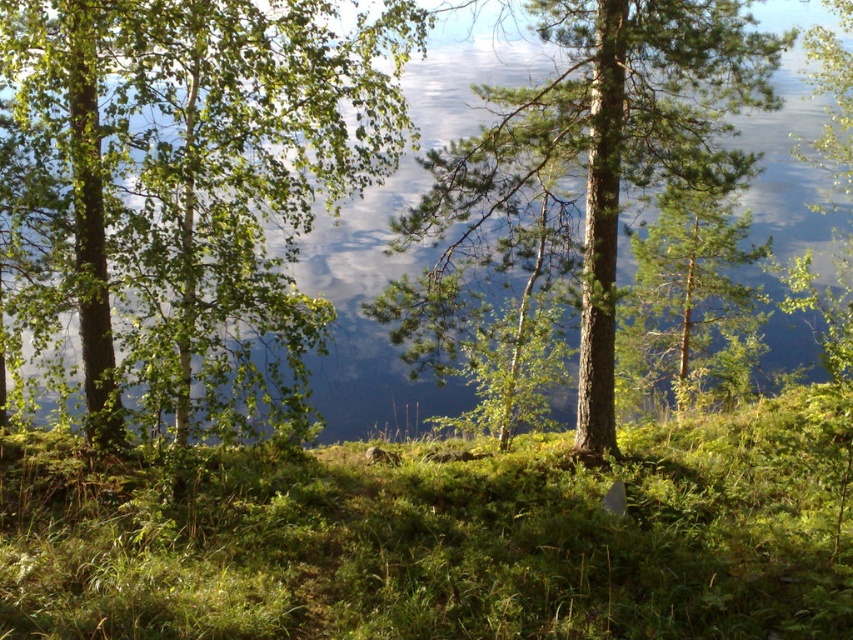
Question: Among these objects, which one is nearest to the camera?

Choices:
 (A) green leafy tree at left
 (B) green rough bark tree at center

Answer: (B)

Question: Which point is farther to the camera?

Choices:
 (A) (537, 20)
 (B) (236, 262)

Answer: (A)

Question: Does green leafy grass at center have a lesser width compared to green rough bark tree at center?

Choices:
 (A) yes
 (B) no

Answer: (B)

Question: In this image, where is green leafy tree at left located relative to green rough bark tree at center?

Choices:
 (A) left
 (B) right

Answer: (A)

Question: Is the position of green leafy tree at left more distant than that of green rough bark tree at center?

Choices:
 (A) yes
 (B) no

Answer: (A)

Question: Which point appears closest to the camera in this image?

Choices:
 (A) (80, 253)
 (B) (627, 108)
 (C) (631, 440)

Answer: (B)